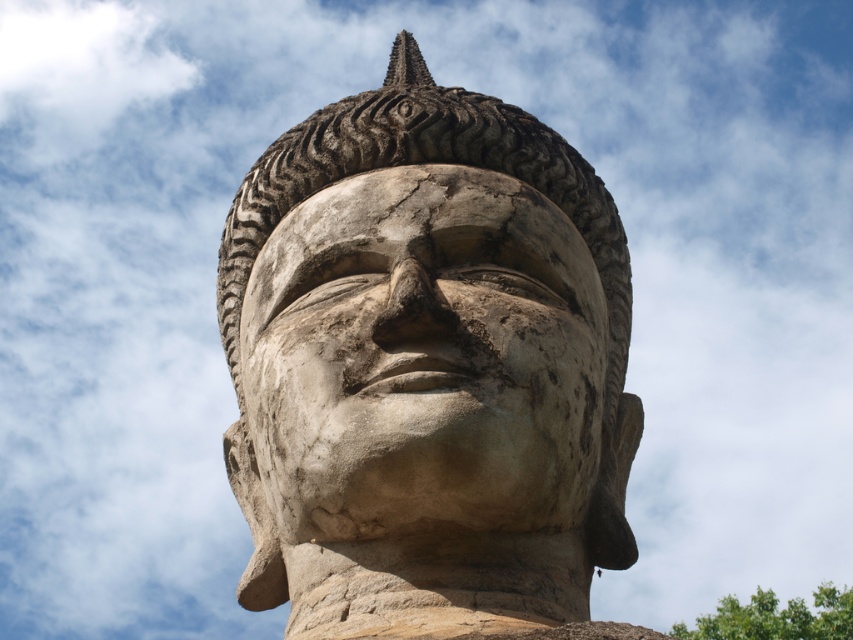
Identify the location of stone statue at center. (426, 368).

Between point (300, 148) and point (485, 342), which one is positioned behind?

Point (300, 148)

Is point (219, 301) closer to camera compared to point (413, 193)?

That is False.

This screenshot has height=640, width=853. What are the coordinates of `stone statue at center` in the screenshot? It's located at (426, 368).